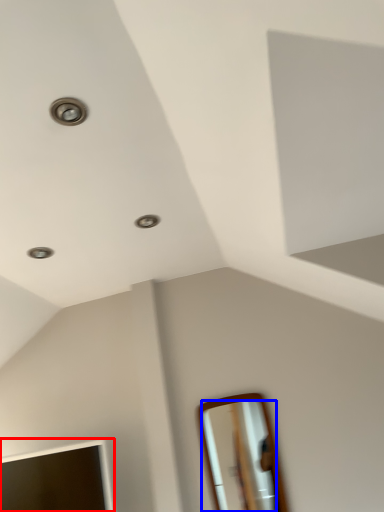
Question: Which object appears closest to the camera in this image, mirror (highlighted by a red box) or mirror (highlighted by a blue box)?

Choices:
 (A) mirror
 (B) mirror

Answer: (A)